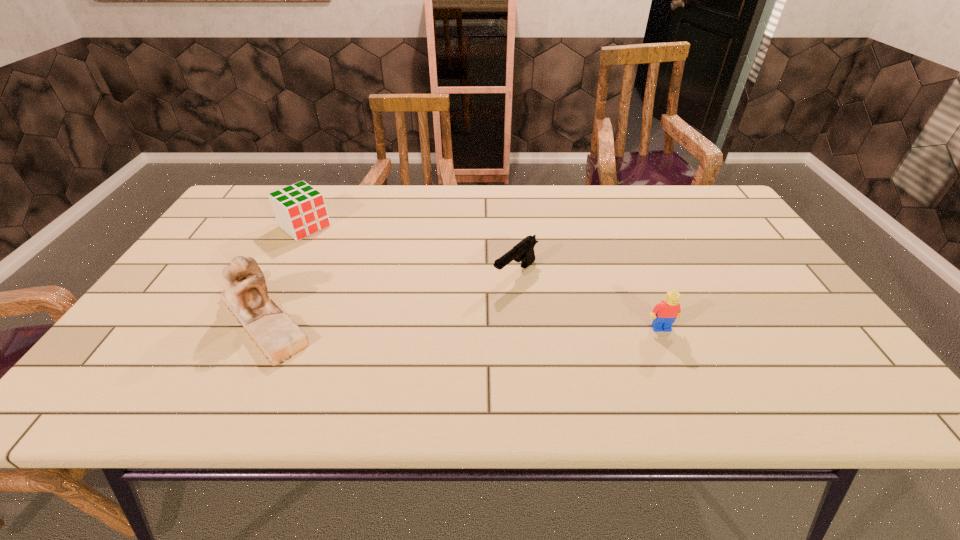
Locate an element on the screen. This screenshot has width=960, height=540. vacant space on the desktop that is between the tallest object and the Lego and is positioned on the front-facing side of the third object from left to right is located at coordinates (454, 323).

Locate an element on the screen. vacant space on the desktop that is between the figurine and the Lego and is positioned on the red face of the farthest object is located at coordinates (427, 322).